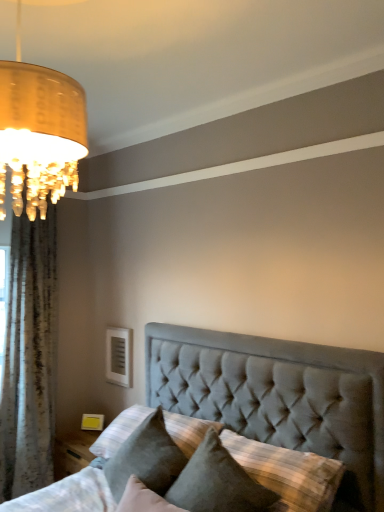
Question: Considering the positions of point (49, 292) and point (221, 495), is point (49, 292) closer or farther from the camera than point (221, 495)?

Choices:
 (A) farther
 (B) closer

Answer: (A)

Question: In the image, is white textured curtain at left positioned in front of or behind suede pillow at center, the 1th pillow in the right-to-left sequence?

Choices:
 (A) behind
 (B) front

Answer: (A)

Question: Estimate the real-world distances between objects in this image. Which object is closer to the velvet gray pillow at lower center, the 1th pillow when ordered from left to right?

Choices:
 (A) suede pillow at center, marked as the second pillow in a left-to-right arrangement
 (B) white textured curtain at left

Answer: (A)

Question: Considering the real-world distances, which object is closest to the white textured curtain at left?

Choices:
 (A) suede pillow at center, marked as the second pillow in a left-to-right arrangement
 (B) velvet gray pillow at lower center, the second pillow viewed from the right

Answer: (B)